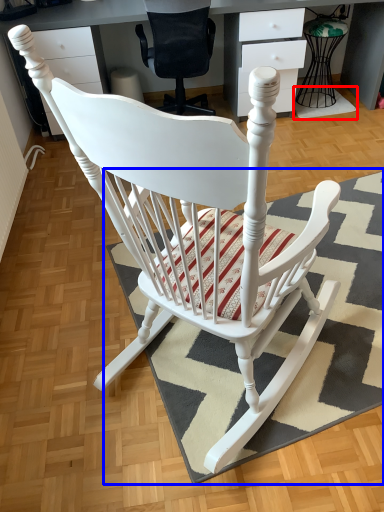
Question: Which object appears farthest to the camera in this image, doormat (highlighted by a red box) or doormat (highlighted by a blue box)?

Choices:
 (A) doormat
 (B) doormat

Answer: (A)